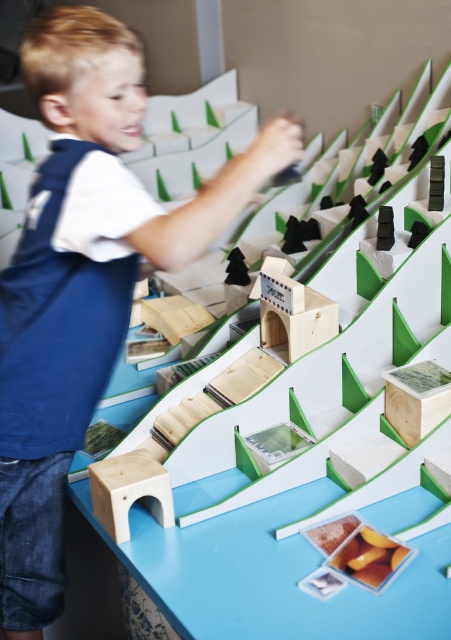
Question: Does blue wood table at center have a greater width compared to blue denim jeans at lower left?

Choices:
 (A) no
 (B) yes

Answer: (B)

Question: Can you confirm if blue wood table at center is positioned to the left of blue denim jeans at lower left?

Choices:
 (A) yes
 (B) no

Answer: (B)

Question: Does blue wood table at center have a larger size compared to blue denim jeans at lower left?

Choices:
 (A) yes
 (B) no

Answer: (A)

Question: Which of the following is the closest to the observer?

Choices:
 (A) blue denim jeans at lower left
 (B) blue wood table at center

Answer: (A)